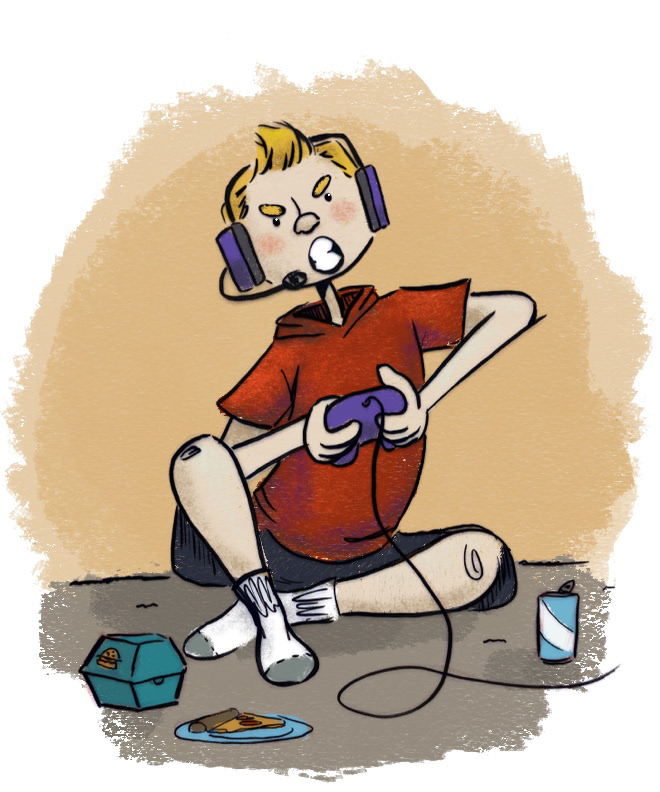
What are the coordinates of `round item that food goes atop` in the screenshot? It's located at (261, 733).